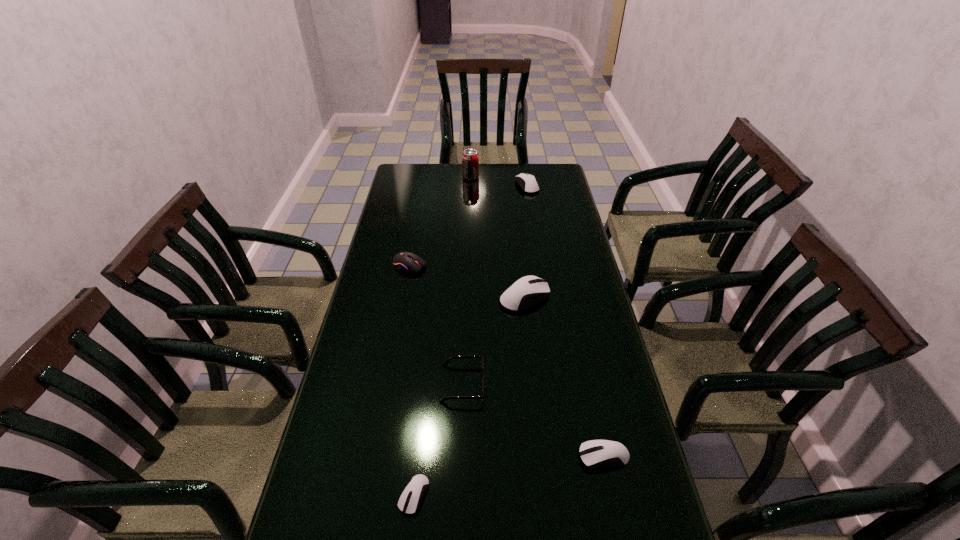
Identify the location of mouse that is positioned at the far edge. The width and height of the screenshot is (960, 540). (529, 185).

At what (x,y) coordinates should I click in order to perform the action: click on object at the left edge. Please return your answer as a coordinate pair (x, y). Looking at the image, I should click on (404, 261).

Image resolution: width=960 pixels, height=540 pixels. Identify the location of object that is at the far right corner. (529, 185).

I want to click on free space at the left edge of the desktop, so click(x=352, y=478).

This screenshot has width=960, height=540. I want to click on vacant space at the right edge, so click(608, 328).

Locate an element on the screen. free location at the far left corner is located at coordinates (426, 168).

Locate an element on the screen. empty space that is in between the farthest white mouse and the third farthest mouse is located at coordinates (526, 241).

Identify the location of vacant area that lies between the third nearest object and the second farthest mouse. (436, 325).

The width and height of the screenshot is (960, 540). I want to click on free spot between the second nearest mouse and the sixth shortest object, so click(564, 376).

Where is `vacant area that lies between the second nearest white mouse and the second farthest white mouse`? This screenshot has width=960, height=540. vacant area that lies between the second nearest white mouse and the second farthest white mouse is located at coordinates (564, 376).